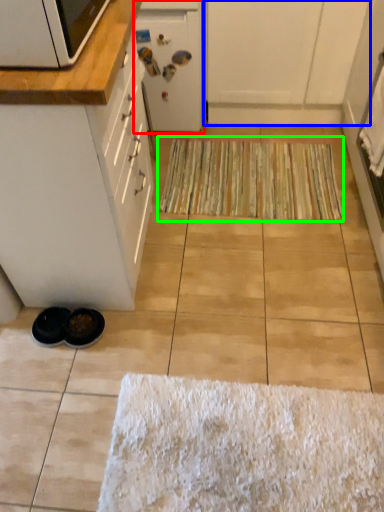
Question: Considering the real-world distances, which object is closest to appliance (highlighted by a red box)? cabinetry (highlighted by a blue box) or doormat (highlighted by a green box).

Choices:
 (A) cabinetry
 (B) doormat

Answer: (A)